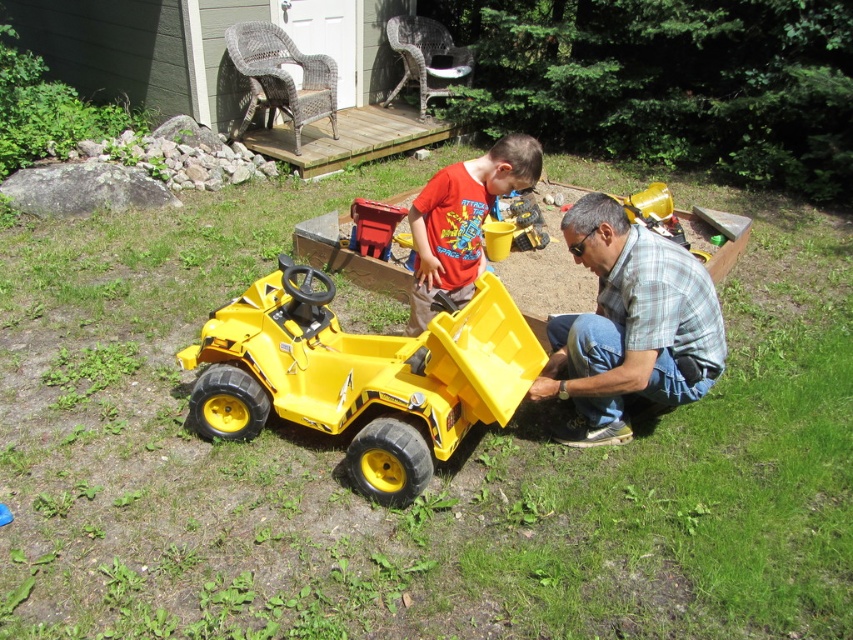
You are a photographer trying to capture a photo of the plaid shirt at lower right and the matte red shirt at center. Since you want to ensure both subjects are in focus, you need to know which one is closer to the camera. Can you determine which shirt is closer?

The plaid shirt at lower right is in front of the matte red shirt at center, so the plaid shirt at lower right is closer to the camera.